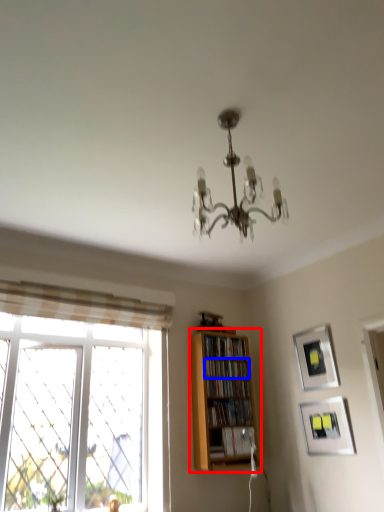
Question: Which object is closer to the camera taking this photo, shelf (highlighted by a red box) or book (highlighted by a blue box)?

Choices:
 (A) shelf
 (B) book

Answer: (A)